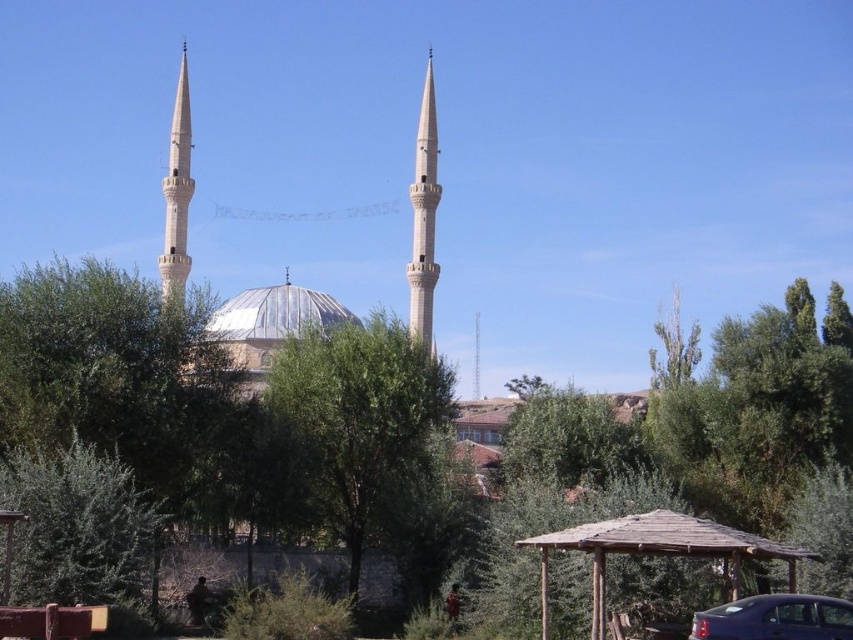
Is point (120, 554) closer to viewer compared to point (212, 323)?

Yes, it is.

Does green leafy tree at lower left appear on the right side of metallic silver dome at center?

In fact, green leafy tree at lower left is to the left of metallic silver dome at center.

At what (x,y) coordinates should I click in order to perform the action: click on green leafy tree at lower left. Please return your answer as a coordinate pair (x, y). Looking at the image, I should click on (77, 525).

Does green leafy tree at center have a smaller size compared to metallic blue sedan at lower right?

Incorrect, green leafy tree at center is not smaller in size than metallic blue sedan at lower right.

Who is positioned more to the left, green leafy tree at center or metallic blue sedan at lower right?

green leafy tree at center

Is point (326, 438) in front of point (784, 636)?

No.

What are the coordinates of `green leafy tree at center` in the screenshot? It's located at (363, 429).

Between point (79, 472) and point (703, 616), which one is positioned behind?

The point (79, 472) is behind.

Does green leafy tree at lower left appear on the left side of metallic blue sedan at lower right?

Indeed, green leafy tree at lower left is positioned on the left side of metallic blue sedan at lower right.

Where is `green leafy tree at lower left`? Image resolution: width=853 pixels, height=640 pixels. green leafy tree at lower left is located at coordinates (77, 525).